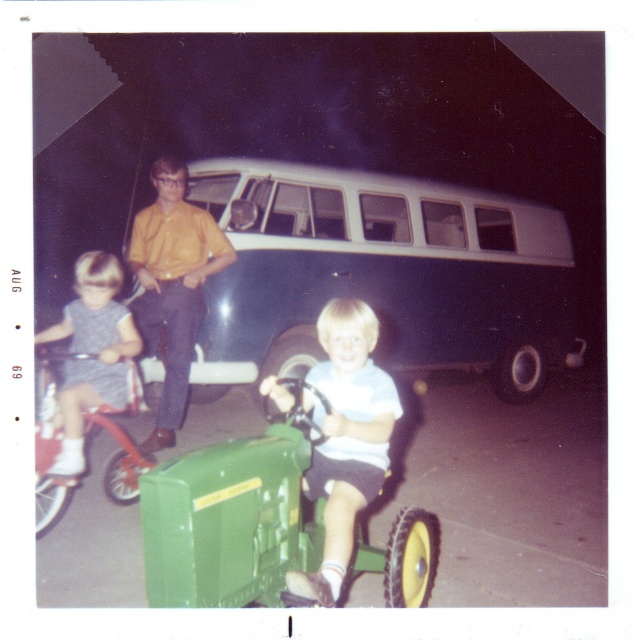
Is matte green tractor at center to the left of yellow shirt at center from the viewer's perspective?

In fact, matte green tractor at center is to the right of yellow shirt at center.

Which is above, matte green tractor at center or yellow shirt at center?

Positioned higher is yellow shirt at center.

Image resolution: width=634 pixels, height=640 pixels. Describe the element at coordinates (344, 438) in the screenshot. I see `matte green tractor at center` at that location.

This screenshot has height=640, width=634. What are the coordinates of `matte green tractor at center` in the screenshot? It's located at (344, 438).

Between point (146, 522) and point (55, 328), which one is positioned in front?

Positioned in front is point (146, 522).

Does green plastic tractor at center have a lesser height compared to denim shorts at left?

Correct, green plastic tractor at center is not as tall as denim shorts at left.

What are the coordinates of `green plastic tractor at center` in the screenshot? It's located at (230, 518).

Between point (333, 545) and point (55, 518), which one is positioned in front?

Positioned in front is point (333, 545).

This screenshot has width=634, height=640. What are the coordinates of `matte green tractor at center` in the screenshot? It's located at (344, 438).